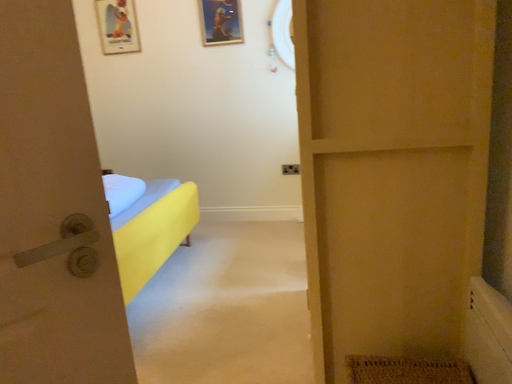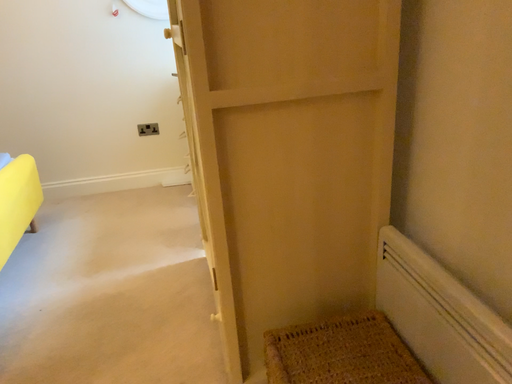
Question: Which way did the camera rotate in the video?

Choices:
 (A) rotated left
 (B) rotated right

Answer: (B)